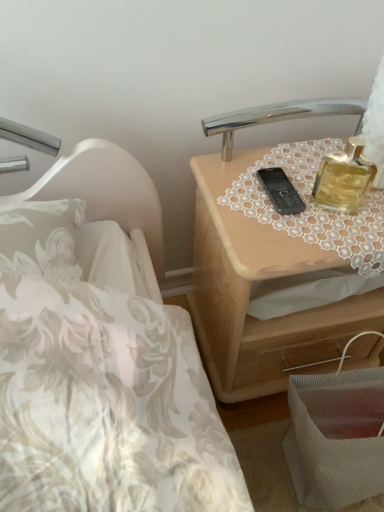
The image size is (384, 512). I want to click on unoccupied space behind gold glass perfume at upper right, so (x=321, y=164).